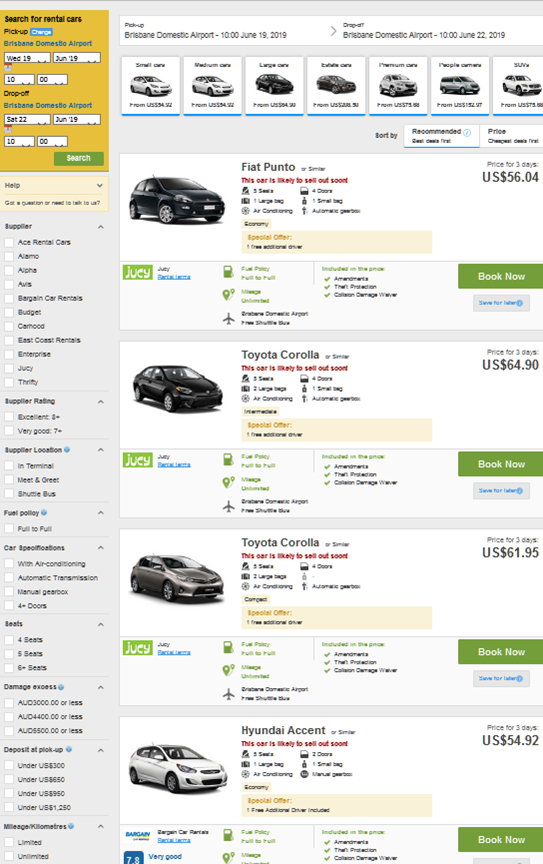
The height and width of the screenshot is (864, 543). In order to click on air condition included in this screenshot , I will do `click(11, 560)`, `click(268, 774)`, `click(267, 583)`, `click(266, 210)`, `click(263, 401)`.